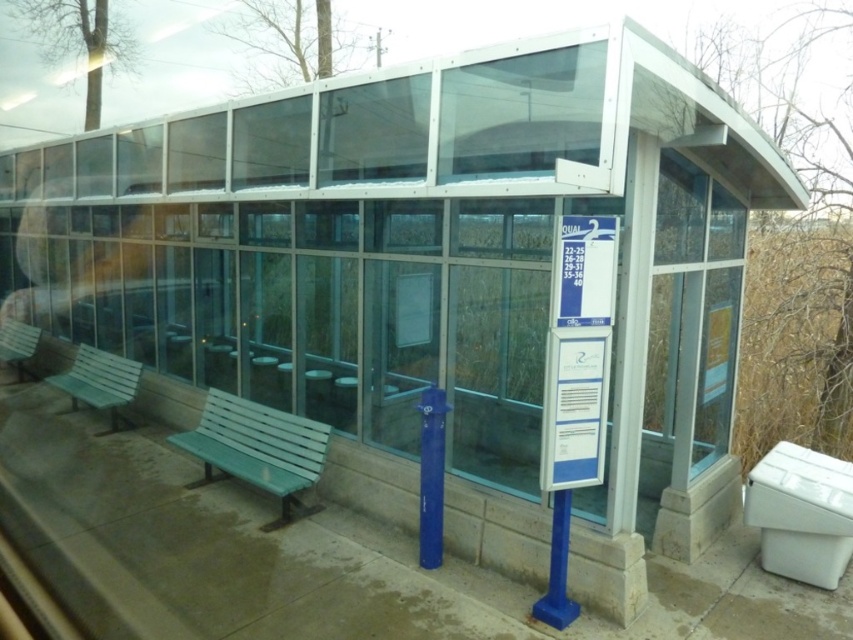
Can you confirm if clear glass window at center is taller than green painted wood bench at left?

Yes.

Is point (689, 330) positioned after point (300, 500)?

No, (689, 330) is in front of (300, 500).

The width and height of the screenshot is (853, 640). Identify the location of clear glass window at center. (689, 324).

Who is higher up, green plastic bench at lower left or green plastic bench at left?

Positioned higher is green plastic bench at left.

In the scene shown: Is green plastic bench at lower left positioned at the back of green plastic bench at left?

No.

This screenshot has width=853, height=640. What are the coordinates of `green plastic bench at lower left` in the screenshot? It's located at [x=100, y=381].

Is point (318, 508) positioned behind point (241, 422)?

No, (318, 508) is closer to viewer.

Between green painted wood bench at left and green painted wood bench at center, which one has more height?

green painted wood bench at center

Which is behind, point (270, 460) or point (241, 465)?

Positioned behind is point (270, 460).

In order to click on green painted wood bench at left in this screenshot , I will do `click(258, 449)`.